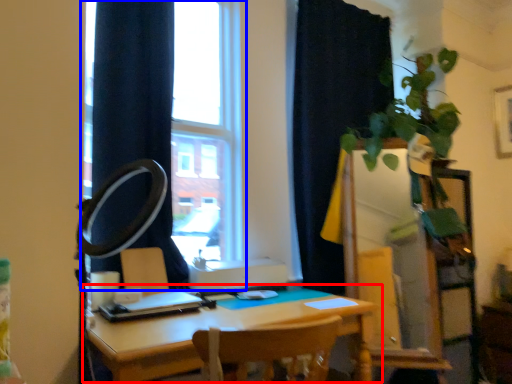
Question: Which of the following is the farthest to the observer, table (highlighted by a red box) or window (highlighted by a blue box)?

Choices:
 (A) table
 (B) window

Answer: (B)